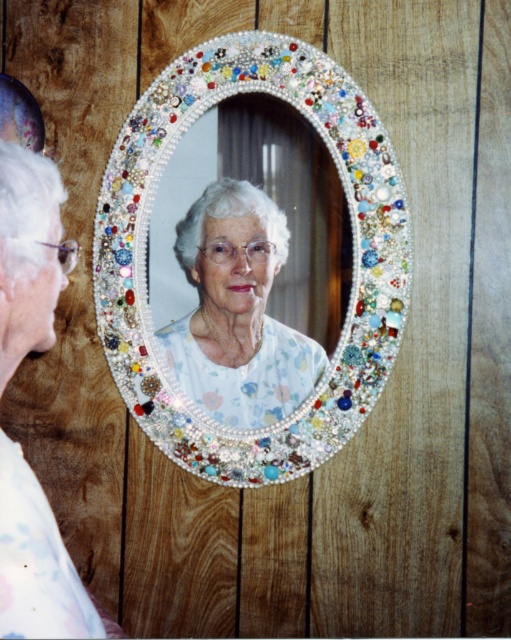
Is pearl-like mosaic mirror at center to the right of floral fabric blouse at left from the viewer's perspective?

Indeed, pearl-like mosaic mirror at center is positioned on the right side of floral fabric blouse at left.

Locate an element on the screen. pearl-like mosaic mirror at center is located at coordinates tap(193, 285).

Locate an element on the screen. pearl-like mosaic mirror at center is located at coordinates (193, 285).

Who is positioned more to the left, floral fabric blouse at center or floral fabric blouse at left?

Positioned to the left is floral fabric blouse at left.

Is floral fabric blouse at center wider than floral fabric blouse at left?

Yes.

The height and width of the screenshot is (640, 511). What do you see at coordinates (238, 310) in the screenshot?
I see `floral fabric blouse at center` at bounding box center [238, 310].

At what (x,y) coordinates should I click in order to perform the action: click on floral fabric blouse at center. Please return your answer as a coordinate pair (x, y). Image resolution: width=511 pixels, height=640 pixels. Looking at the image, I should click on (238, 310).

Between point (179, 289) and point (267, 408), which one is positioned behind?

Positioned behind is point (179, 289).

Where is `pearl-like mosaic mirror at center`? pearl-like mosaic mirror at center is located at coordinates (193, 285).

Locate an element on the screen. pearl-like mosaic mirror at center is located at coordinates (193, 285).